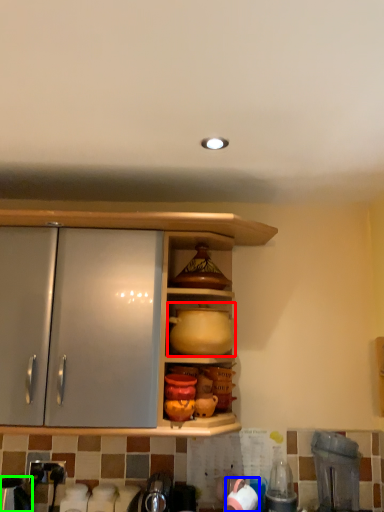
Question: Considering the real-world distances, which object is farthest from pottery (highlighted by a red box)? tableware (highlighted by a blue box) or appliance (highlighted by a green box)?

Choices:
 (A) tableware
 (B) appliance

Answer: (B)